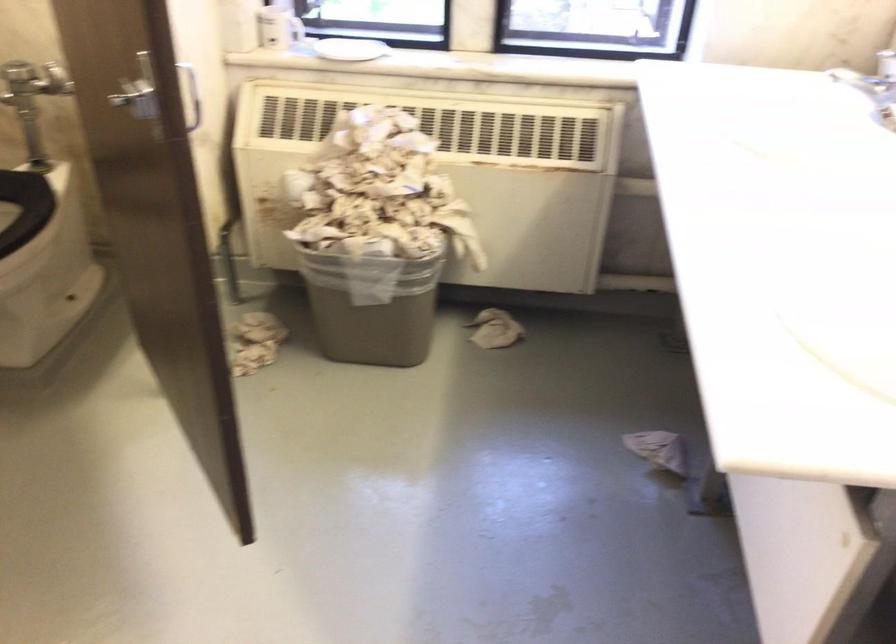
Identify the location of silver door handle. (138, 102).